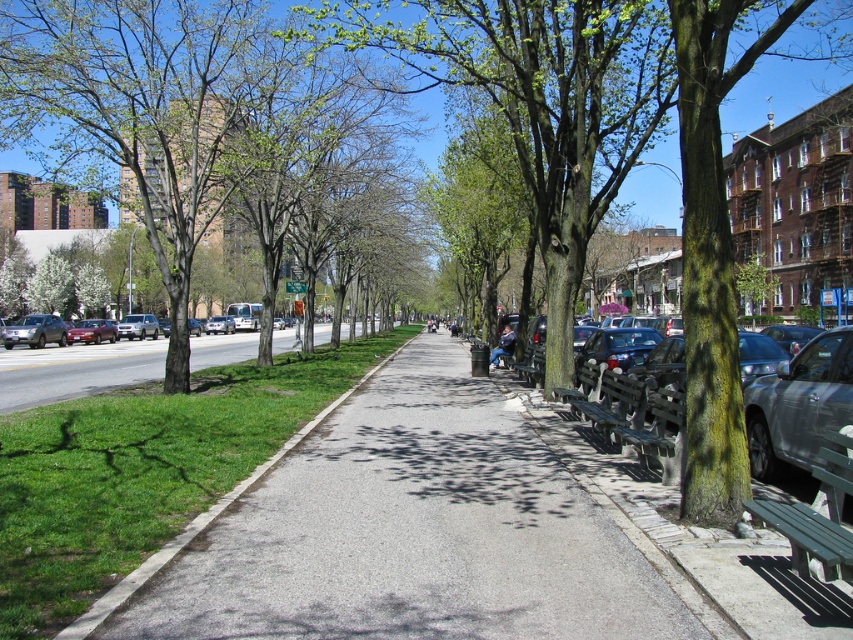
You are a delivery person who needs to park your bike between the green wood bench at lower right and the matte red sedan at left. Since the bench is smaller than the sedan, which object should you place your bike closer to to ensure enough space?

You should place your bike closer to the green wood bench at lower right because it has a smaller size compared to the matte red sedan at left, providing more space for the bike.

Consider the image. You are planning to place a metallic silver bench at right next to a matte red sedan at left in the park. Considering their widths, which one is narrower?

The metallic silver bench at right is narrower than the matte red sedan at left.

You are a delivery robot with a width of 1.2 meters. You need to navigate through the park while avoiding obstacles. Can you safely pass between the gray asphalt pavement at center and the wooden park bench at right without hitting either?

The distance between the gray asphalt pavement at center and the wooden park bench at right is 2.59 meters. Since the robot is 1.2 meters wide, there is sufficient space to pass safely between them as 2.59 meters is greater than 1.2 meters.